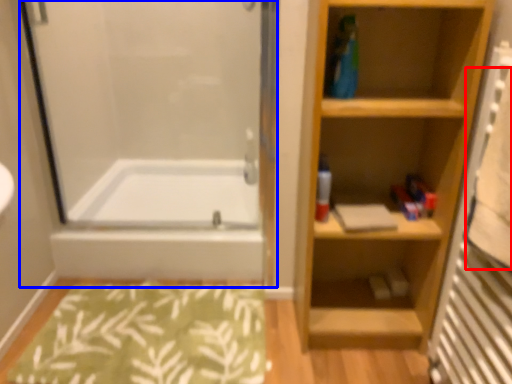
Question: Which object appears farthest to the camera in this image, bath towel (highlighted by a red box) or screen door (highlighted by a blue box)?

Choices:
 (A) bath towel
 (B) screen door

Answer: (B)